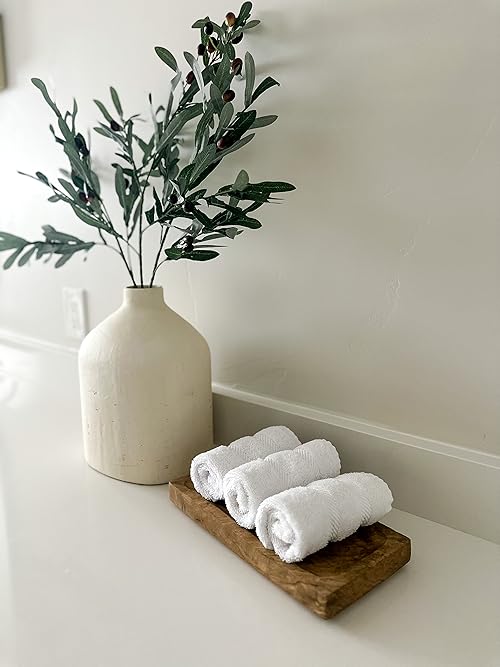
I want to click on towel holder, so click(336, 586).